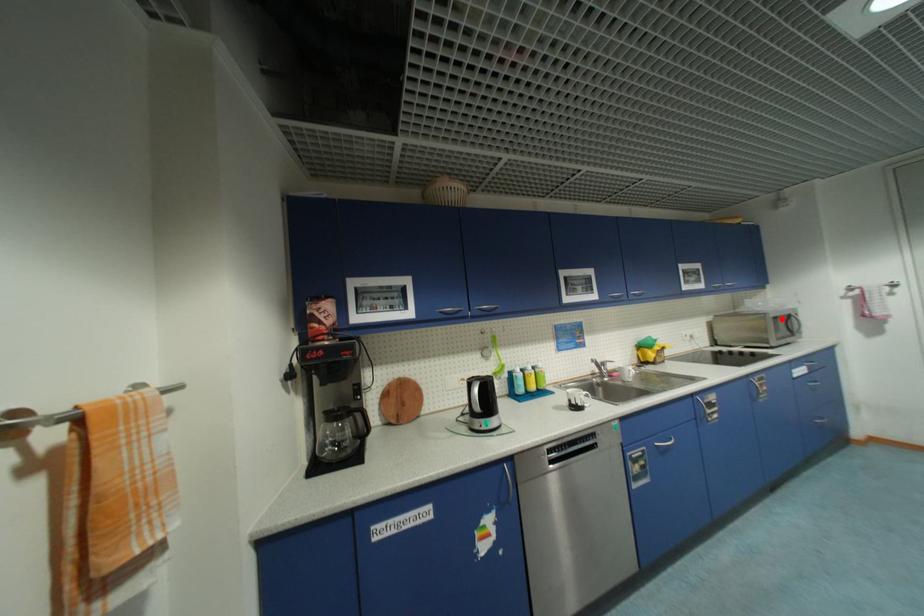
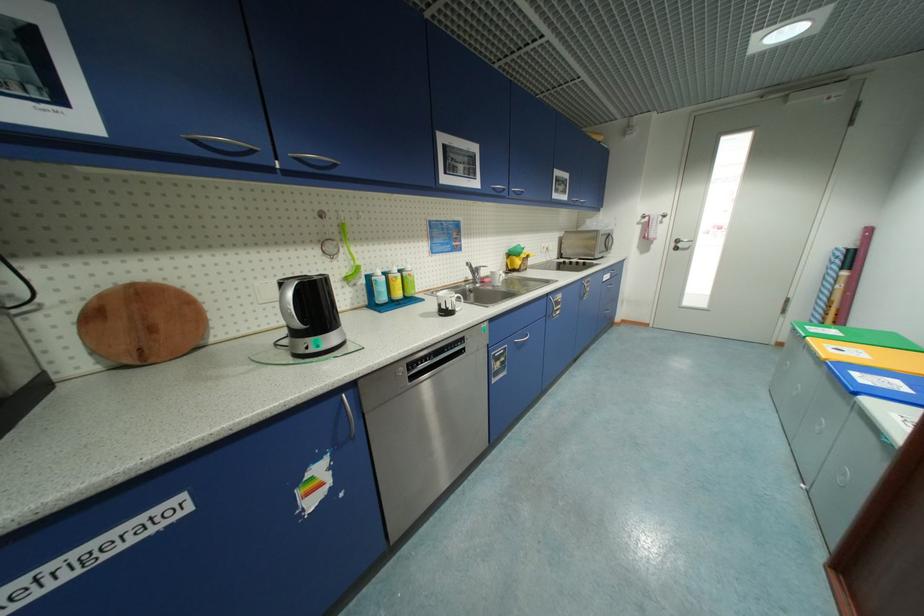
Question: I am providing you with two images of the same scene from different viewpoints. Image1 has a red point marked. In image2, the corresponding 3D location appears at what relative position? Reply with the corresponding letter.

Choices:
 (A) Closer
 (B) Farther

Answer: (A)